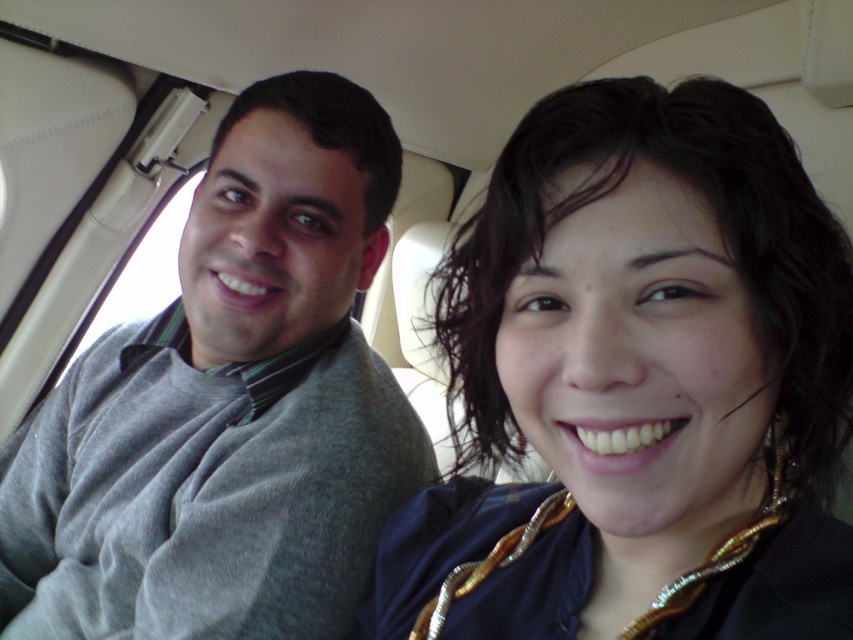
You are a flight attendant checking the seating arrangement in the aircraft cabin. You need to ensure that the dark blue fabric at center and the gray sweater at left are properly positioned. Based on their positions, which object is located lower in the cabin?

The dark blue fabric at center is located lower than the gray sweater at left in the cabin.

Looking at this image, you are a flight attendant checking the safety of passengers in the aircraft cabin. You notice the dark blue fabric at center and the gray sweater at left. Which clothing item is shorter in length?

→ The dark blue fabric at center is shorter than the gray sweater at left.